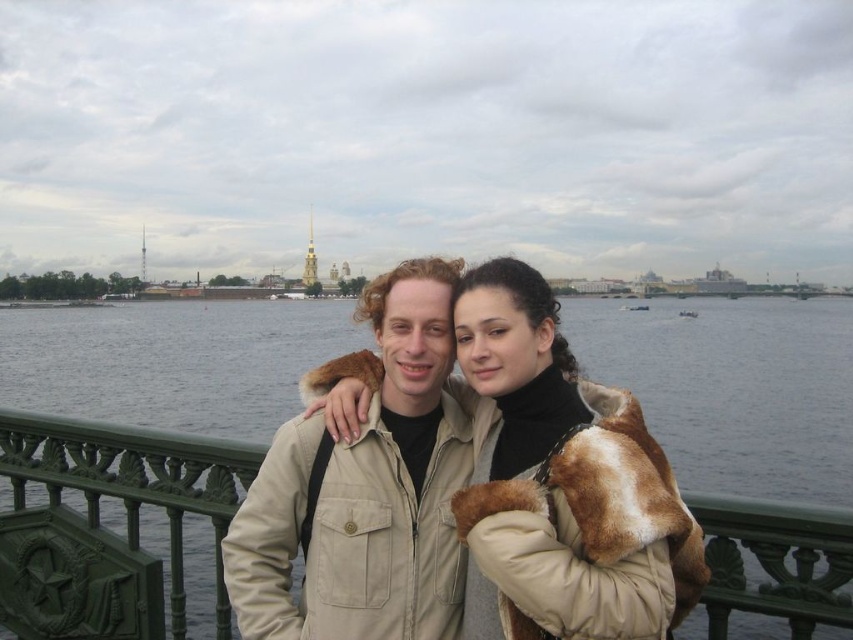
Question: Can you confirm if fur-lined beige coat at center is positioned to the right of beige fabric jacket at center?

Choices:
 (A) yes
 (B) no

Answer: (A)

Question: Which of these objects is positioned farthest from the green metal railing at center?

Choices:
 (A) beige fabric jacket at center
 (B) fur-lined beige coat at center

Answer: (B)

Question: Is fur-lined beige coat at center to the left of green metal railing at center from the viewer's perspective?

Choices:
 (A) yes
 (B) no

Answer: (B)

Question: Which object is positioned farthest from the fur-lined beige coat at center?

Choices:
 (A) green metal railing at center
 (B) beige fabric jacket at center

Answer: (A)

Question: Does fur-lined beige coat at center have a lesser width compared to green metal railing at center?

Choices:
 (A) no
 (B) yes

Answer: (B)

Question: Which point is farther from the camera taking this photo?

Choices:
 (A) (486, 280)
 (B) (383, 369)
 (C) (6, 524)

Answer: (C)